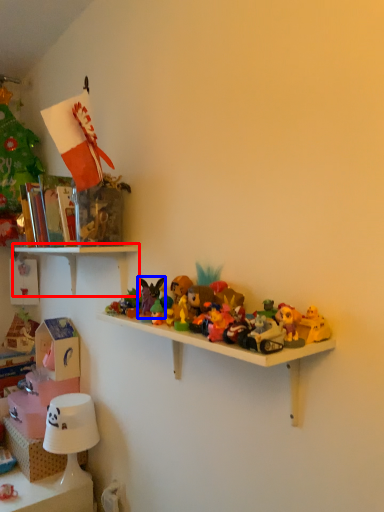
Question: Which object appears closest to the camera in this image, shelf (highlighted by a red box) or toy (highlighted by a blue box)?

Choices:
 (A) shelf
 (B) toy

Answer: (B)